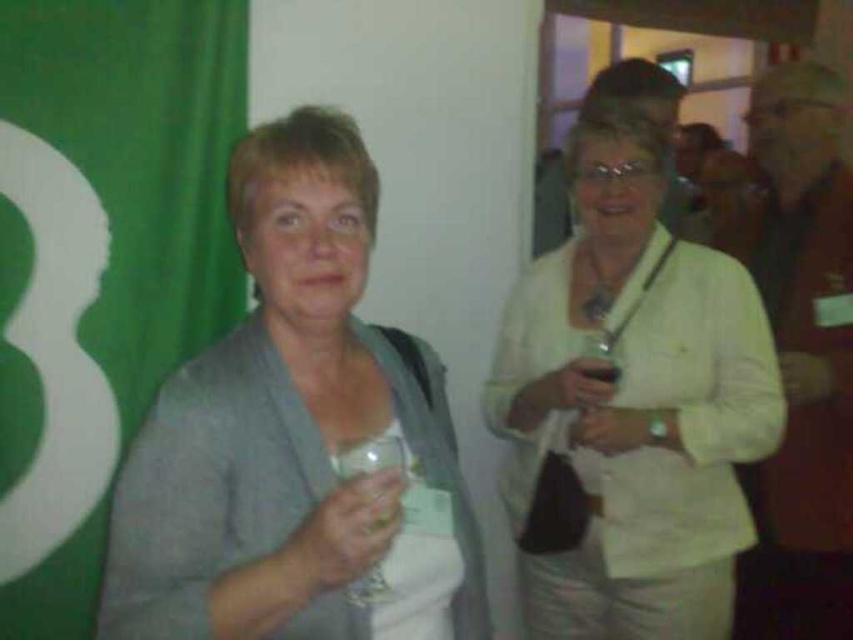
Between white matte jacket at center and transparent plastic glass at center, which one is positioned lower?

Positioned lower is white matte jacket at center.

Does white matte jacket at center have a greater height compared to transparent plastic glass at center?

Yes, white matte jacket at center is taller than transparent plastic glass at center.

Is point (508, 422) farther from viewer compared to point (601, 376)?

Yes, it is.

Find the location of a particular element. Image resolution: width=853 pixels, height=640 pixels. white matte jacket at center is located at coordinates (634, 403).

Is gray fabric at center positioned at the back of white matte jacket at center?

No.

The image size is (853, 640). I want to click on gray fabric at center, so click(x=294, y=440).

Where is `gray fabric at center`? This screenshot has width=853, height=640. gray fabric at center is located at coordinates (294, 440).

Consider the image. Who is positioned more to the left, gray fabric at center or transparent plastic glass at center?

Positioned to the left is gray fabric at center.

Does point (173, 579) lie behind point (585, 369)?

No.

Identify the location of gray fabric at center. (294, 440).